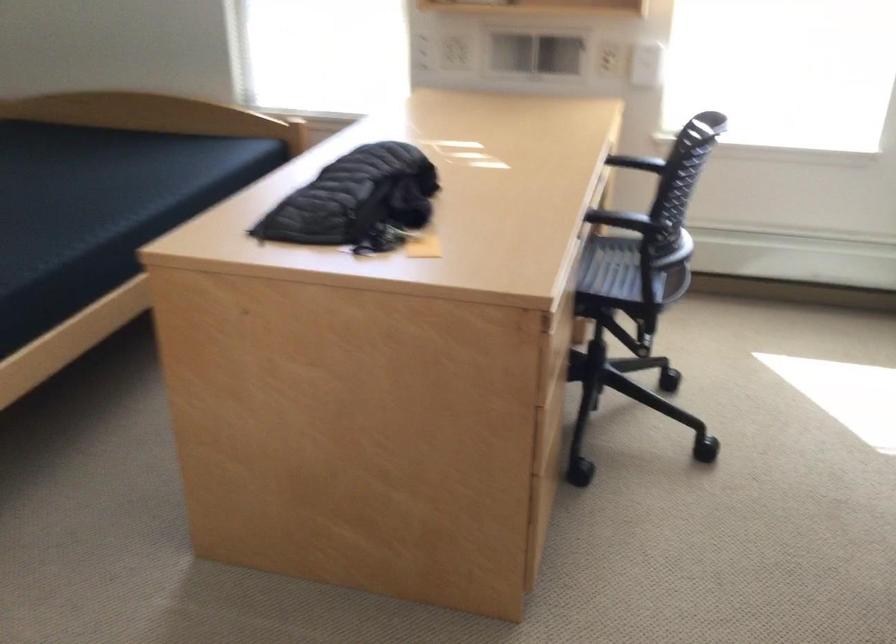
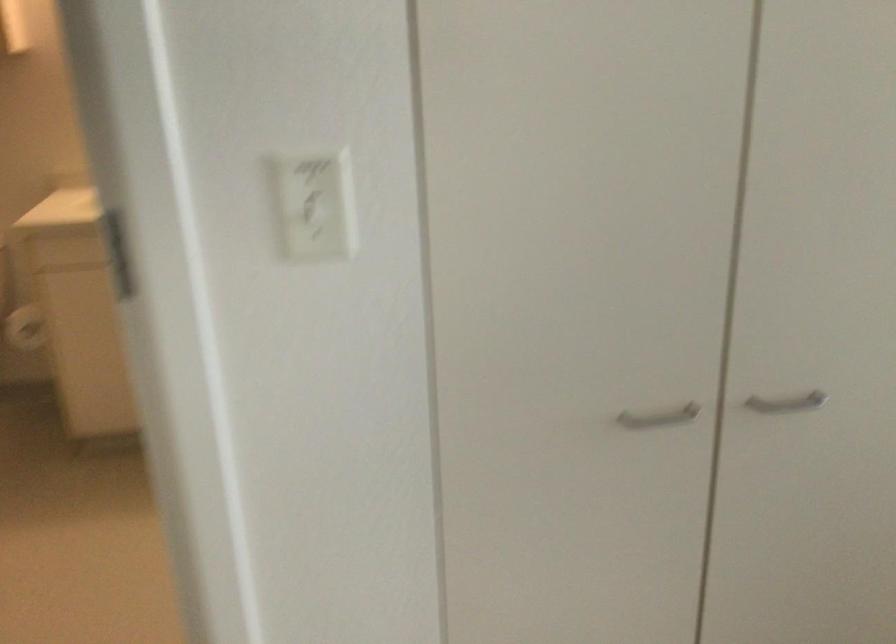
Question: The camera is either moving clockwise (left) or counter-clockwise (right) around the object. The first image is from the beginning of the video and the second image is from the end. Is the camera moving left or right when shooting the video?

Choices:
 (A) Left
 (B) Right

Answer: (B)